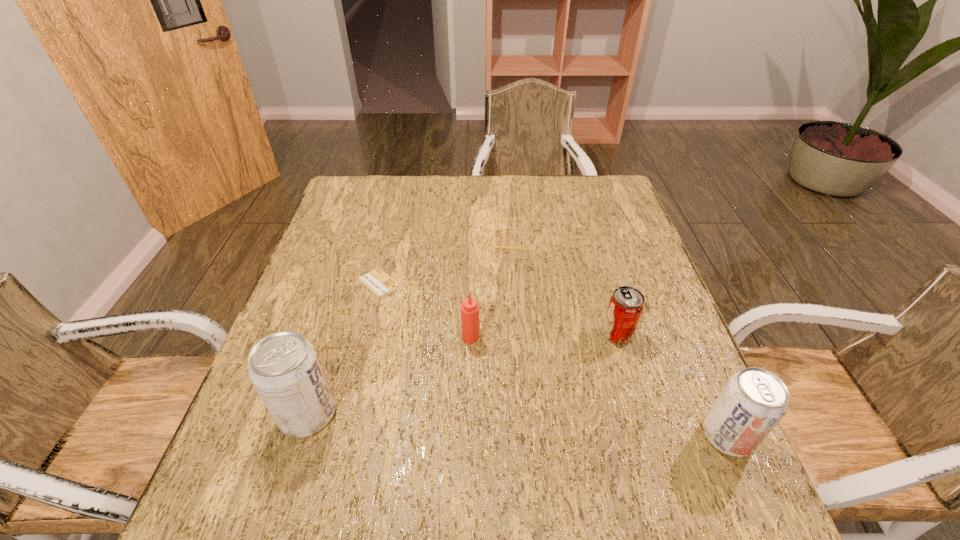
Locate an element on the screen. This screenshot has width=960, height=540. identity card that is at the left edge is located at coordinates (377, 281).

This screenshot has width=960, height=540. In order to click on object at the near left corner in this screenshot , I will do `click(284, 368)`.

The height and width of the screenshot is (540, 960). I want to click on object situated at the near right corner, so click(x=754, y=400).

Where is `vacant area at the far edge of the desktop`? vacant area at the far edge of the desktop is located at coordinates (484, 197).

Image resolution: width=960 pixels, height=540 pixels. What are the coordinates of `vacant space at the near edge of the desktop` in the screenshot? It's located at (337, 441).

Identify the location of vacant space at the left edge. (324, 235).

In the image, there is a desktop. Where is `free space at the right edge`? The width and height of the screenshot is (960, 540). free space at the right edge is located at coordinates (684, 343).

Identify the location of vacant space at the far left corner of the desktop. (348, 182).

The image size is (960, 540). Identify the location of vacant space at the near left corner of the desktop. (256, 457).

Where is `free region at the far right corner`? Image resolution: width=960 pixels, height=540 pixels. free region at the far right corner is located at coordinates (575, 205).